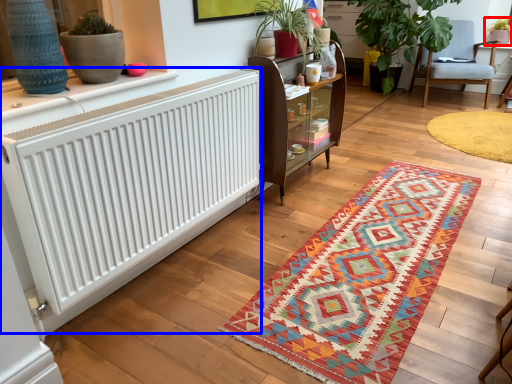
Question: Which of the following is the farthest to the observer, houseplant (highlighted by a red box) or radiator (highlighted by a blue box)?

Choices:
 (A) houseplant
 (B) radiator

Answer: (A)